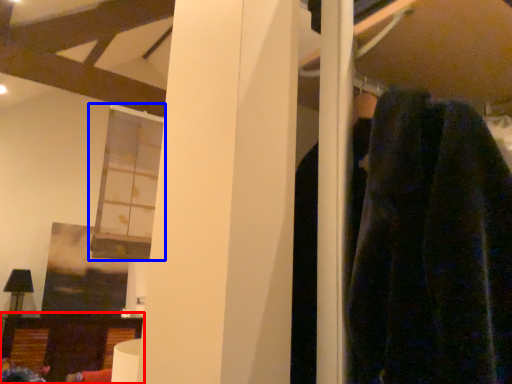
Question: Which object appears farthest to the camera in this image, furniture (highlighted by a red box) or window (highlighted by a blue box)?

Choices:
 (A) furniture
 (B) window

Answer: (A)